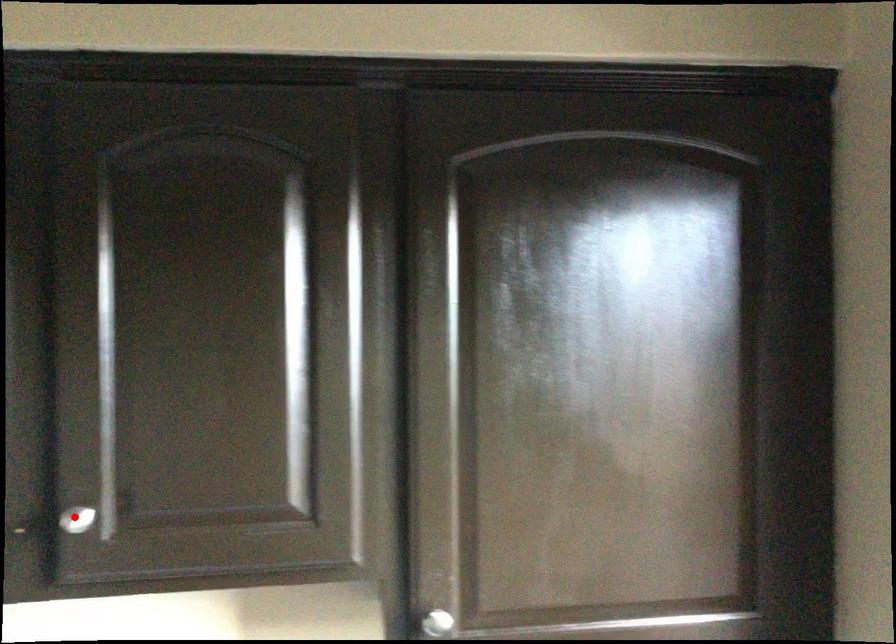
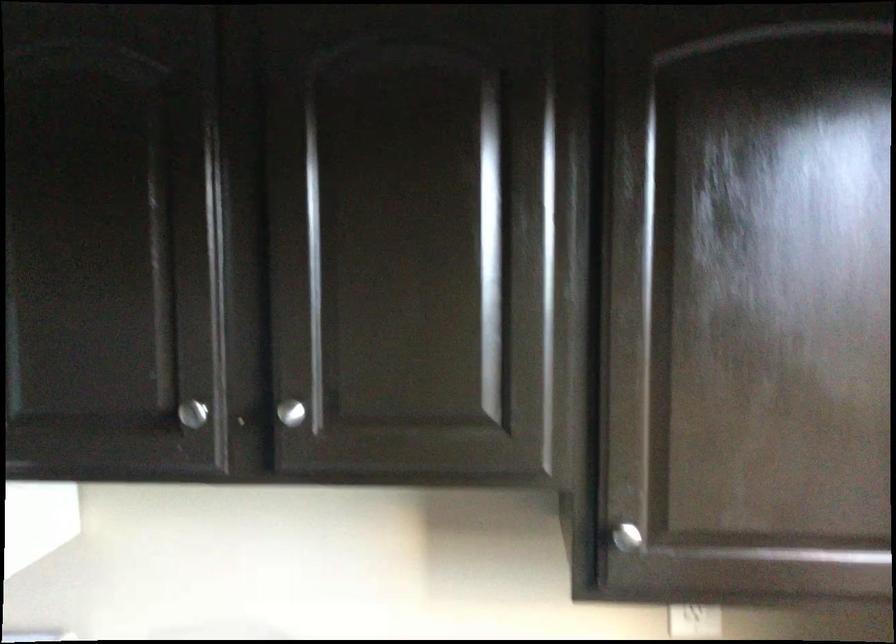
The point at the highlighted location is marked in the first image. Where is the corresponding point in the second image?

(290, 412)